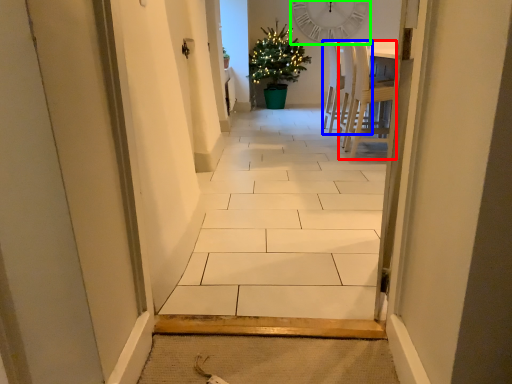
Question: Which object is positioned farthest from chair (highlighted by a red box)? Select from chair (highlighted by a blue box) and clock (highlighted by a green box).

Choices:
 (A) chair
 (B) clock

Answer: (B)